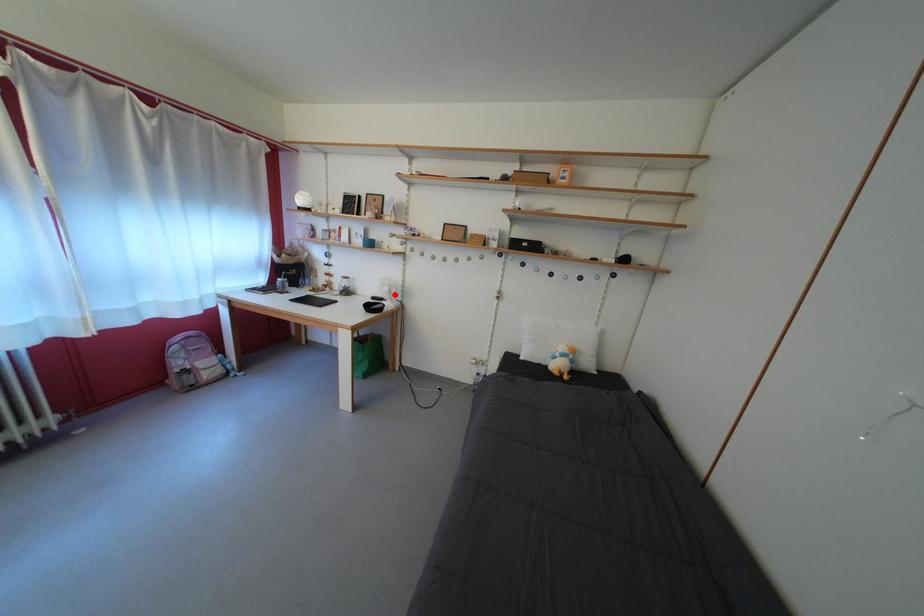
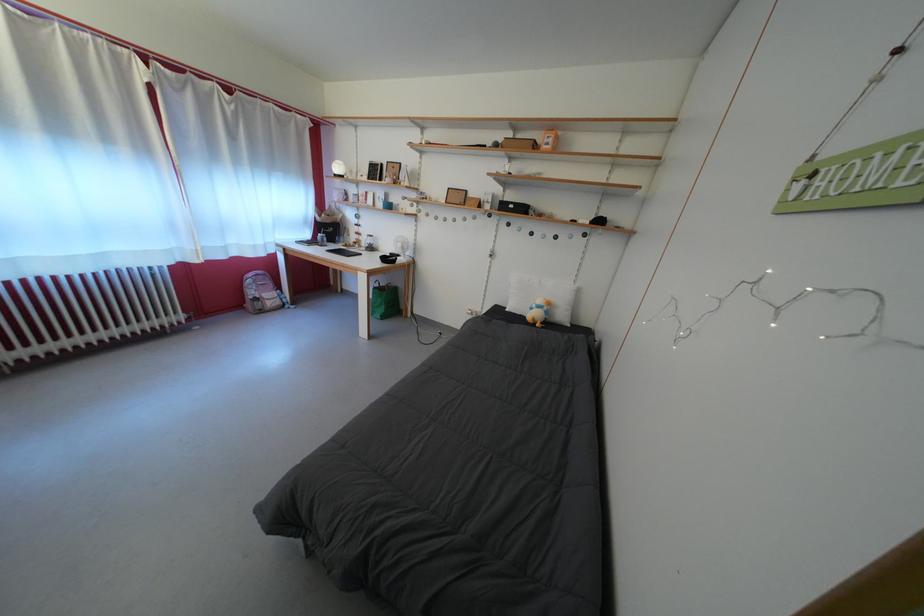
The point at the highlighted location is marked in the first image. Where is the corresponding point in the second image?

(407, 251)